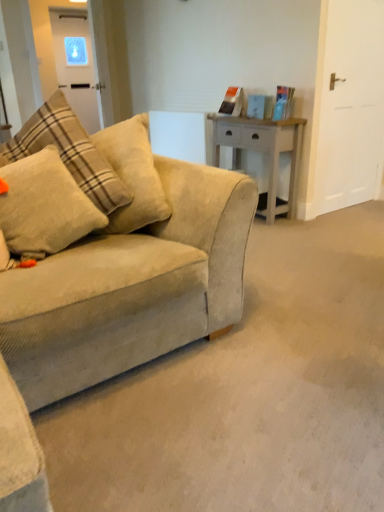
Question: Would you say transparent glass door at upper left, which appears as the second glass door when viewed from the front, is inside or outside fluffy beige pillow at left?

Choices:
 (A) inside
 (B) outside

Answer: (B)

Question: From the image's perspective, relative to fluffy beige pillow at left, is transparent glass door at upper left, arranged as the 1th glass door when viewed from the back, above or below?

Choices:
 (A) above
 (B) below

Answer: (A)

Question: Estimate the real-world distances between objects in this image. Which object is closer to the white matte door at right, which ranks as the second glass door in left-to-right order?

Choices:
 (A) transparent glass door at upper left, the second glass door in the right-to-left sequence
 (B) white wood side table at center
 (C) fluffy beige pillow at left

Answer: (B)

Question: Estimate the real-world distances between objects in this image. Which object is closer to the transparent glass door at upper left, the second glass door in the right-to-left sequence?

Choices:
 (A) white wood side table at center
 (B) white matte door at right, marked as the second glass door in a back-to-front arrangement
 (C) fluffy beige pillow at left

Answer: (A)